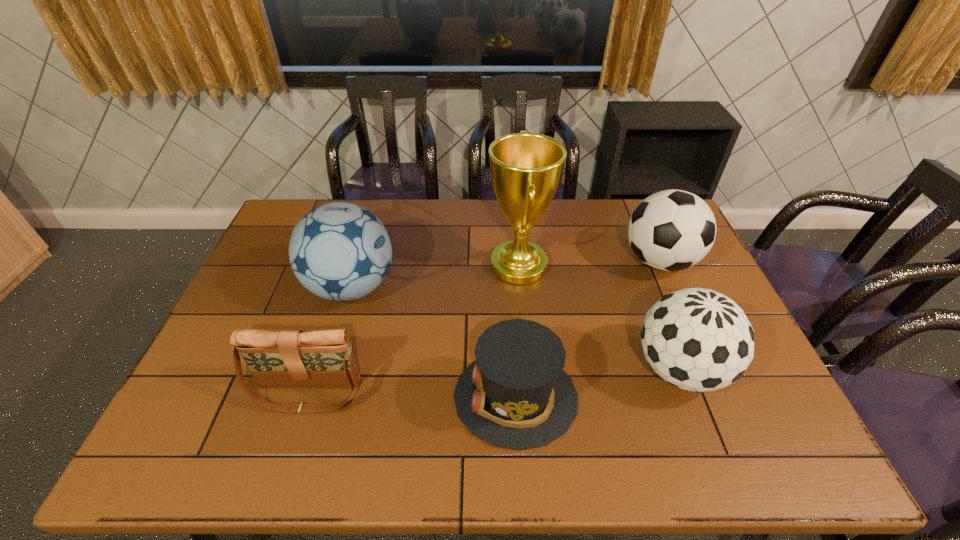
You are a GUI agent. You are given a task and a screenshot of the screen. Output one action in this format:
    pyautogui.click(x=<x>, y=<y>)
    Task: Click on the vacant area that satisfies the following two spatial constraints: 1. by the handles of the tallest object; 2. on the left side of the nearest soccer ball
    
    Given the screenshot: What is the action you would take?
    pyautogui.click(x=528, y=369)

Where is `vacant space that satisfies the following two spatial constraints: 1. by the handles of the nearest soccer ball; 2. on the left side of the award`? The width and height of the screenshot is (960, 540). vacant space that satisfies the following two spatial constraints: 1. by the handles of the nearest soccer ball; 2. on the left side of the award is located at coordinates (528, 369).

Identify the location of vacant space that satisfies the following two spatial constraints: 1. on the side with brand of the leftmost soccer ball; 2. on the front-facing side of the shoulder bag. The image size is (960, 540). (321, 393).